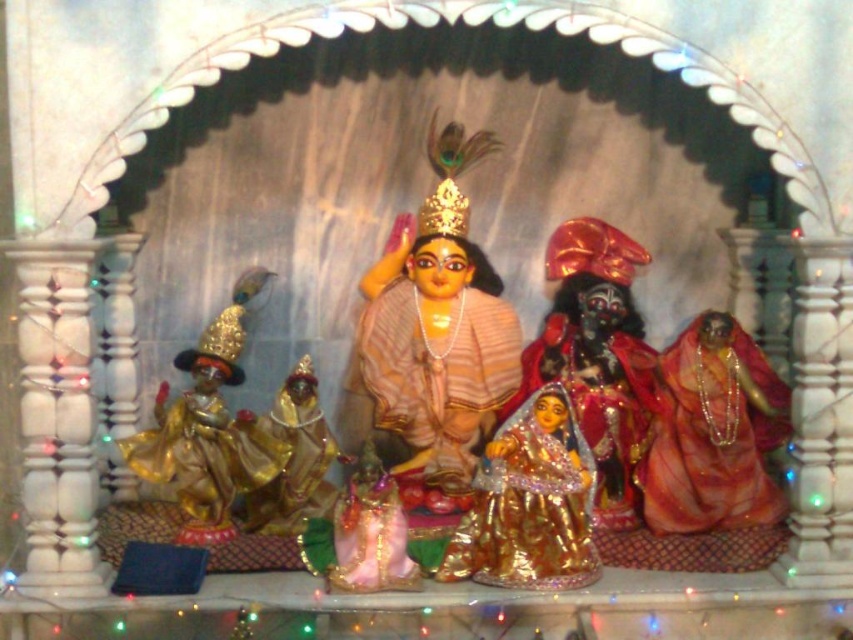
At what (x,y) coordinates should I click in order to perform the action: click on shiny gold statue at center. Please return your answer as a coordinate pair (x, y). The height and width of the screenshot is (640, 853). Looking at the image, I should click on (596, 356).

Looking at this image, does shiny gold statue at center come behind gold metallic statue at center?

Yes, shiny gold statue at center is further from the viewer.

Between point (624, 444) and point (257, 493), which one is positioned behind?

The point (624, 444) is behind.

I want to click on shiny gold statue at center, so click(x=596, y=356).

Who is positioned more to the left, gold metallic figure at left or gold metallic statue at center?

Positioned to the left is gold metallic figure at left.

Based on the photo, which of these two, gold metallic figure at left or gold metallic statue at center, stands taller?

gold metallic figure at left

Who is more distant from viewer, (230, 432) or (302, 426)?

The point (302, 426) is behind.

The width and height of the screenshot is (853, 640). What are the coordinates of `gold metallic figure at left` in the screenshot? It's located at (196, 433).

Which is in front, point (585, 337) or point (225, 515)?

Positioned in front is point (225, 515).

Is point (546, 372) positioned before point (148, 454)?

No.

Locate an element on the screen. The height and width of the screenshot is (640, 853). shiny gold statue at center is located at coordinates (596, 356).